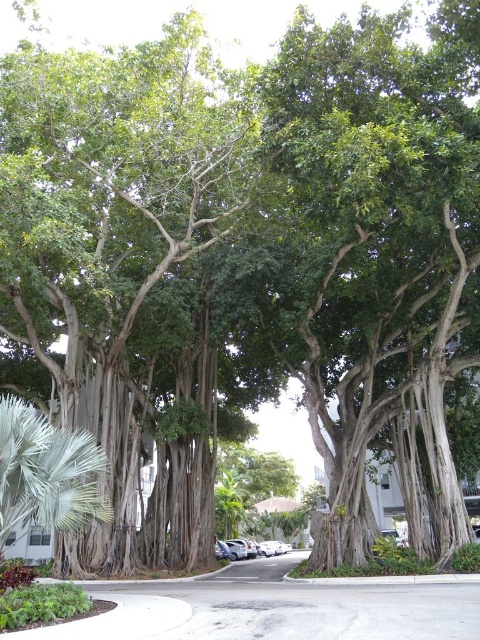
Question: Is green leafy banyan tree at center below silver metallic car at center?

Choices:
 (A) yes
 (B) no

Answer: (B)

Question: Observing the image, what is the correct spatial positioning of green leafy banyan tree at center in reference to silver metallic car at center?

Choices:
 (A) left
 (B) right

Answer: (B)

Question: Is green leafy banyan tree at center bigger than silver metallic car at center?

Choices:
 (A) yes
 (B) no

Answer: (A)